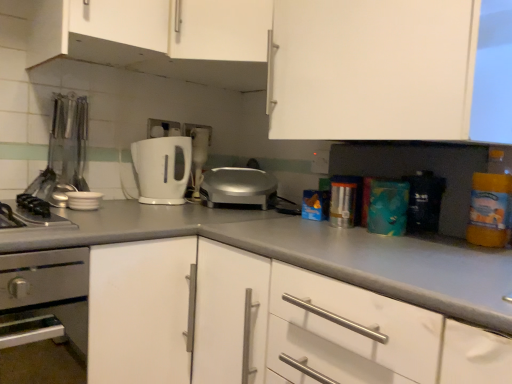
Question: Does translucent plastic bottle at right have a larger size compared to white matte countertop at center?

Choices:
 (A) yes
 (B) no

Answer: (B)

Question: Is translucent plastic bottle at right in front of white matte countertop at center?

Choices:
 (A) yes
 (B) no

Answer: (B)

Question: Does translucent plastic bottle at right have a greater width compared to white matte countertop at center?

Choices:
 (A) no
 (B) yes

Answer: (A)

Question: Can you confirm if translucent plastic bottle at right is positioned to the right of white matte countertop at center?

Choices:
 (A) no
 (B) yes

Answer: (B)

Question: Could you tell me if translucent plastic bottle at right is turned towards white matte countertop at center?

Choices:
 (A) yes
 (B) no

Answer: (B)

Question: Can you confirm if translucent plastic bottle at right is thinner than white matte countertop at center?

Choices:
 (A) yes
 (B) no

Answer: (A)

Question: Can you confirm if stainless steel oven at lower left is taller than metallic silver utensils at left, arranged as the third appliance when viewed from the right?

Choices:
 (A) no
 (B) yes

Answer: (B)

Question: Is stainless steel oven at lower left facing away from metallic silver utensils at left, arranged as the third appliance when viewed from the right?

Choices:
 (A) no
 (B) yes

Answer: (A)

Question: Is stainless steel oven at lower left touching metallic silver utensils at left, arranged as the third appliance when viewed from the right?

Choices:
 (A) yes
 (B) no

Answer: (B)

Question: Can you confirm if stainless steel oven at lower left is positioned to the left of metallic silver utensils at left, the 1th appliance positioned from the left?

Choices:
 (A) yes
 (B) no

Answer: (A)

Question: Is stainless steel oven at lower left shorter than metallic silver utensils at left, arranged as the third appliance when viewed from the right?

Choices:
 (A) no
 (B) yes

Answer: (A)

Question: Is stainless steel oven at lower left not close to metallic silver utensils at left, arranged as the third appliance when viewed from the right?

Choices:
 (A) no
 (B) yes

Answer: (A)

Question: Does translucent plastic bottle at right appear on the right side of silver metallic toaster at center, the 1th toaster viewed from the right?

Choices:
 (A) yes
 (B) no

Answer: (A)